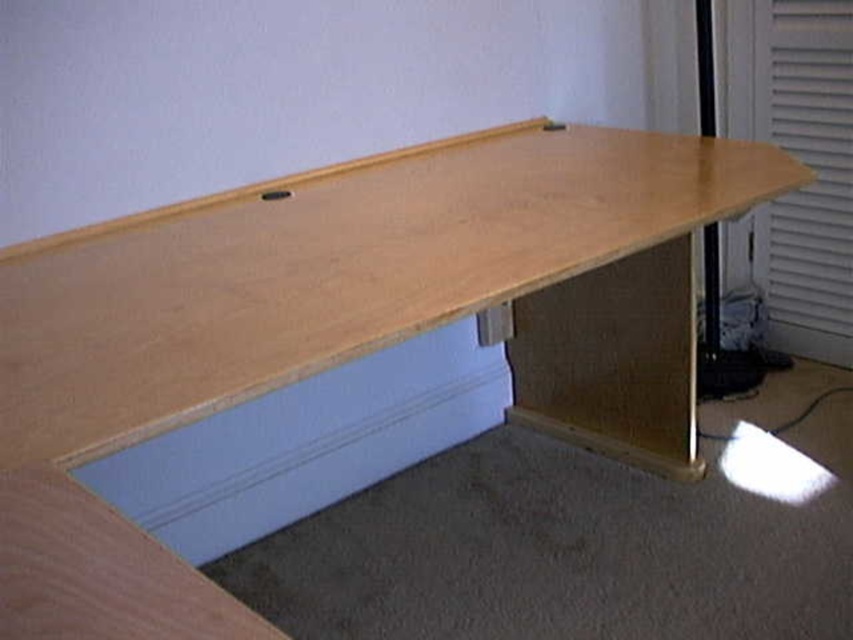
You are organizing a small toy car that is 15 cm long. You need to place it either in the light blue plastic drawer at lower center or on the white textured blind at right. Which location can accommodate the toy car based on their sizes?

The light blue plastic drawer at lower center has a larger size compared to the white textured blind at right, so the toy car can fit in the light blue plastic drawer at lower center.

You are moving a 3.5 feet wide box from the left side of the desk. Can you slide it between the light blue plastic drawer at lower center and the white textured blind at right without tilting it?

The distance between the light blue plastic drawer at lower center and the white textured blind at right is 4.41 feet. Since the box is 3.5 feet wide, it can fit through the space as 3.5 is less than 4.41.